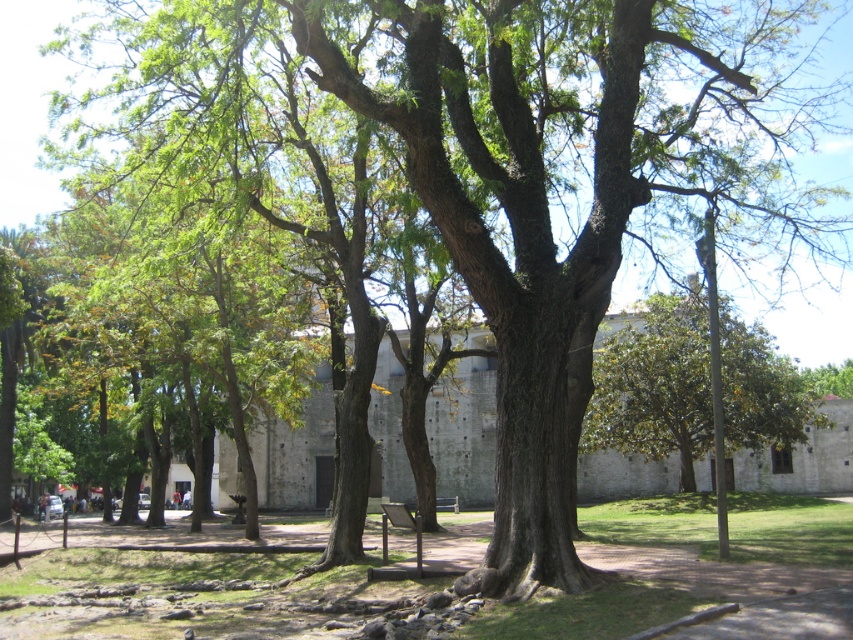
You are standing in the park and see the brown rough tree at center and the green leafy tree at center. Which tree is located to the left when facing the park?

The brown rough tree at center is positioned on the left side of green leafy tree at center, so when facing the park, the brown rough tree at center is to the left of the green leafy tree at center.

You are a park visitor standing in the middle of the park. You see the brown rough tree at center and the green leafy tree at center. Which tree is closer to you?

The brown rough tree at center is closer to you because it is in front of the green leafy tree at center.